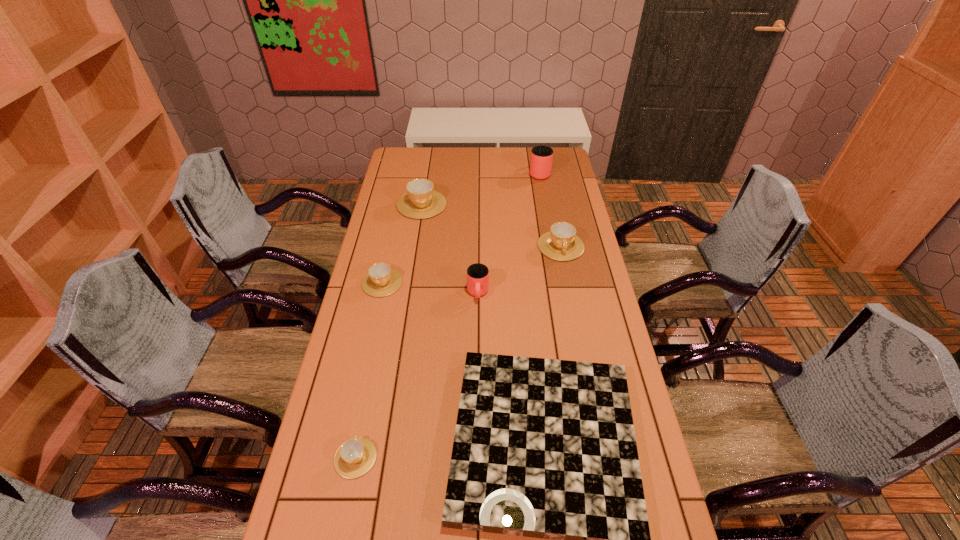
The image size is (960, 540). What are the coordinates of `blank space located with the handle on the side of the third biggest brown cup` in the screenshot? It's located at (391, 242).

Where is `free spot located 0.150m with the handle on the side of the third biggest brown cup`? free spot located 0.150m with the handle on the side of the third biggest brown cup is located at coordinates click(x=391, y=242).

At what (x,y) coordinates should I click in order to perform the action: click on vacant space located with the handle on the side of the third biggest brown cup. Please return your answer as a coordinate pair (x, y). Image resolution: width=960 pixels, height=540 pixels. Looking at the image, I should click on pyautogui.click(x=398, y=208).

Image resolution: width=960 pixels, height=540 pixels. Find the location of `free space located with the handle on the side of the shortest cup`. free space located with the handle on the side of the shortest cup is located at coordinates coord(372,373).

Find the location of a particular element. This screenshot has width=960, height=540. free space located 0.290m with the handle on the side of the shortest cup is located at coordinates (377, 348).

Locate an element on the screen. vacant space located 0.090m with the handle on the side of the shortest cup is located at coordinates (366, 407).

I want to click on object present at the far edge, so click(x=541, y=159).

Find the location of a particular element. The width and height of the screenshot is (960, 540). object that is at the far right corner is located at coordinates [541, 159].

Find the location of `vacant region at the far edge of the desktop`. vacant region at the far edge of the desktop is located at coordinates (443, 171).

Where is `vacant space at the left edge of the desktop`? vacant space at the left edge of the desktop is located at coordinates (401, 269).